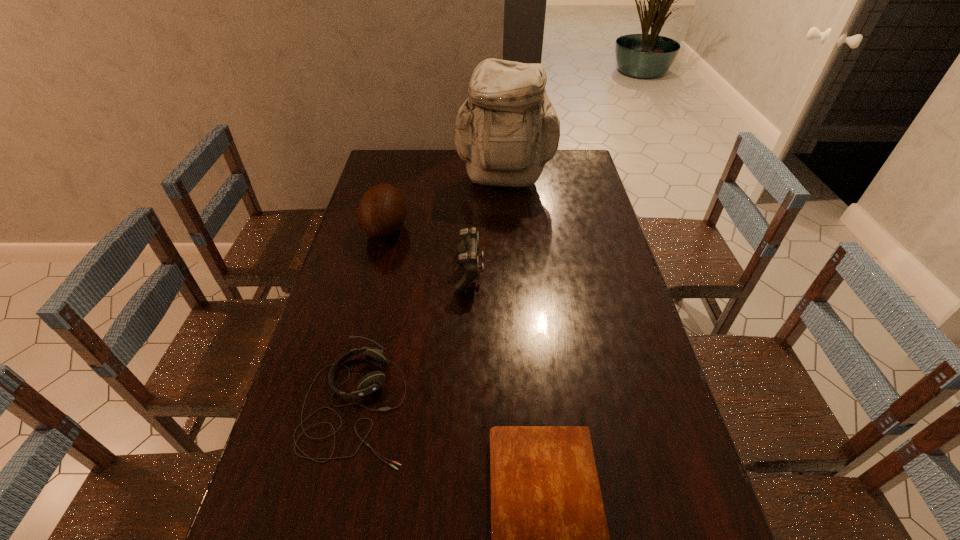
At what (x,y) coordinates should I click in order to perform the action: click on vacant area between the football and the farthest object. Please return your answer as a coordinate pair (x, y). Looking at the image, I should click on click(445, 206).

Identify the location of free space between the control and the football. (427, 251).

The image size is (960, 540). I want to click on the fourth closest object relative to the fourth tallest object, so click(507, 130).

Identify the location of the fourth closest object to the control. The width and height of the screenshot is (960, 540). (549, 536).

Image resolution: width=960 pixels, height=540 pixels. I want to click on free space that satisfies the following two spatial constraints: 1. on the front-facing side of the farthest object; 2. on the surface of the control with buttons, so click(x=512, y=273).

I want to click on free spot that satisfies the following two spatial constraints: 1. on the front-facing side of the farthest object; 2. on the surface of the control with buttons, so click(x=512, y=273).

I want to click on vacant space that satisfies the following two spatial constraints: 1. on the front-facing side of the tallest object; 2. on the laces of the football, so click(x=508, y=229).

This screenshot has height=540, width=960. What are the coordinates of `vacant region that satisfies the following two spatial constraints: 1. on the front-facing side of the backpack; 2. on the outer surface of the fourth tallest object` in the screenshot? It's located at (521, 405).

The image size is (960, 540). I want to click on vacant region that satisfies the following two spatial constraints: 1. on the front-facing side of the backpack; 2. on the outer surface of the headset, so click(521, 405).